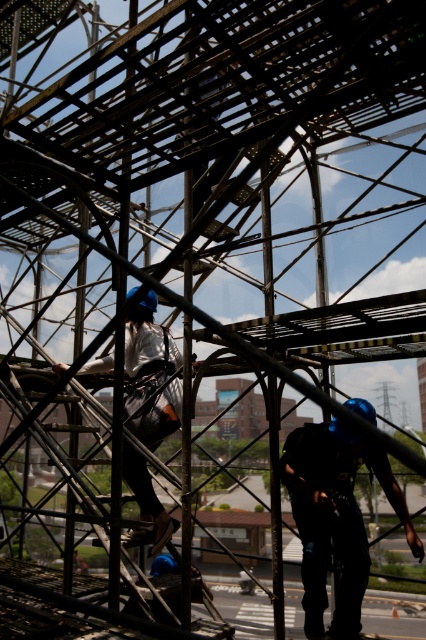
You are a safety inspector at the construction site. You need to ensure that the metallic scaffolding at center is tall enough to allow the worker in the matte white shirt at center to stand upright without hitting their head. Based on the scene, can you confirm if the scaffolding meets this requirement?

The metallic scaffolding at center has a greater height compared to the matte white shirt at center, so it is likely tall enough for the worker to stand upright without hitting their head.

You are a safety inspector at the construction site. You need to ensure that the shiny blue helmet at center is visible from the control room located behind the metallic scaffolding at center. Based on the scene description, is the helmet likely visible? Please explain your reasoning.

The metallic scaffolding at center might be wider than the shiny blue helmet at center. Since the scaffolding is described as dominating the foreground and midground with a complex network, it is possible that the scaffolding could block the view of the helmet from behind. Therefore, the helmet might not be fully visible from the control room.